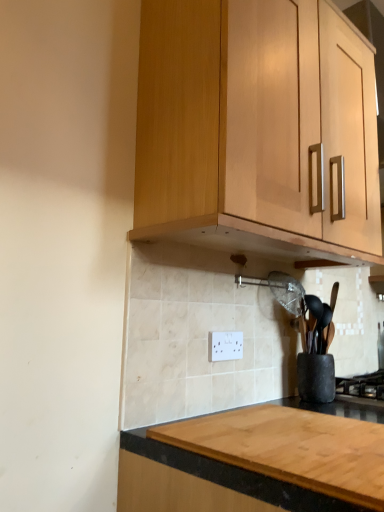
Measure the distance between point [241,335] and camera.

The depth of point [241,335] is 4.32 feet.

Describe the element at coordinates (251, 127) in the screenshot. I see `light wood cabinet at upper center` at that location.

Describe the element at coordinates (362, 386) in the screenshot. I see `black matte gas stove at lower right` at that location.

Locate an element on the screen. This screenshot has height=512, width=384. white plastic electric outlet at center is located at coordinates (225, 346).

From the image's perspective, which one is positioned higher, light wood cabinet at upper center or white plastic electric outlet at center?

light wood cabinet at upper center.

Does light wood cabinet at upper center appear on the left side of white plastic electric outlet at center?

No, light wood cabinet at upper center is not to the left of white plastic electric outlet at center.

Is light wood cabinet at upper center smaller than white plastic electric outlet at center?

No, light wood cabinet at upper center is not smaller than white plastic electric outlet at center.

From a real-world perspective, is black granite countertop at lower center over black matte gas stove at lower right?

No, from a real-world perspective, black granite countertop at lower center is not above black matte gas stove at lower right.

Does point (308, 443) come in front of point (345, 396)?

Yes.

Is black granite countertop at lower center in contact with black matte gas stove at lower right?

There is a gap between black granite countertop at lower center and black matte gas stove at lower right.

From the image's perspective, which one is positioned higher, black granite countertop at lower center or light wood cabinet at upper center?

light wood cabinet at upper center appears higher in the image.

Considering the relative sizes of black granite countertop at lower center and light wood cabinet at upper center in the image provided, is black granite countertop at lower center smaller than light wood cabinet at upper center?

Correct, black granite countertop at lower center occupies less space than light wood cabinet at upper center.

The image size is (384, 512). I want to click on cabinetry on the left of black granite countertop at lower center, so click(x=251, y=127).

Considering the relative sizes of black granite countertop at lower center and light wood cabinet at upper center in the image provided, is black granite countertop at lower center wider than light wood cabinet at upper center?

Yes.

From the image's perspective, which one is positioned higher, white plastic electric outlet at center or black granite countertop at lower center?

white plastic electric outlet at center.

Is white plastic electric outlet at center placed right next to black granite countertop at lower center?

There is a gap between white plastic electric outlet at center and black granite countertop at lower center.

Where is `electric outlet that is above the black granite countertop at lower center (from the image's perspective)`? electric outlet that is above the black granite countertop at lower center (from the image's perspective) is located at coordinates (225, 346).

Considering the positions of objects white plastic electric outlet at center and black granite countertop at lower center in the image provided, who is more to the left, white plastic electric outlet at center or black granite countertop at lower center?

white plastic electric outlet at center is more to the left.

Are black granite countertop at lower center and white plastic electric outlet at center far apart?

black granite countertop at lower center is near white plastic electric outlet at center, not far away.

In the scene shown: Does black granite countertop at lower center lie behind white plastic electric outlet at center?

That is False.

Could white plastic electric outlet at center be considered to be inside black granite countertop at lower center?

No, white plastic electric outlet at center is not inside black granite countertop at lower center.

This screenshot has width=384, height=512. In the image, there is a black matte gas stove at lower right. Find the location of `cabinetry above it (from the image's perspective)`. cabinetry above it (from the image's perspective) is located at coordinates (251, 127).

Considering the relative positions of light wood cabinet at upper center and black matte gas stove at lower right in the image provided, is light wood cabinet at upper center to the right of black matte gas stove at lower right from the viewer's perspective?

In fact, light wood cabinet at upper center is to the left of black matte gas stove at lower right.

Which object is further away from the camera, light wood cabinet at upper center or black matte gas stove at lower right?

black matte gas stove at lower right is behind.

From the image's perspective, is light wood cabinet at upper center above or below black matte gas stove at lower right?

Based on their image positions, light wood cabinet at upper center is located above black matte gas stove at lower right.

Are black matte gas stove at lower right and light wood cabinet at upper center far apart?

Actually, black matte gas stove at lower right and light wood cabinet at upper center are a little close together.

Is black matte gas stove at lower right facing away from light wood cabinet at upper center?

No.

Does black matte gas stove at lower right have a smaller size compared to light wood cabinet at upper center?

Yes.

Based on the photo, which is more to the left, black matte gas stove at lower right or light wood cabinet at upper center?

light wood cabinet at upper center is more to the left.

Where is `electric outlet below the light wood cabinet at upper center (from a real-world perspective)`? electric outlet below the light wood cabinet at upper center (from a real-world perspective) is located at coordinates (225, 346).

You are a GUI agent. You are given a task and a screenshot of the screen. Output one action in this format:
    pyautogui.click(x=<x>, y=<y>)
    Task: Click on the countertop lying on the left of black matte gas stove at lower right
    
    Given the screenshot: What is the action you would take?
    pos(254,463)

From the image, which object appears to be nearer to light wood cabinet at upper center, white plastic electric outlet at center or black matte gas stove at lower right?

white plastic electric outlet at center lies closer to light wood cabinet at upper center than the other object.

Estimate the real-world distances between objects in this image. Which object is further from light wood cabinet at upper center, black matte gas stove at lower right or black granite countertop at lower center?

black matte gas stove at lower right is further to light wood cabinet at upper center.

Based on the photo, when comparing their distances from white plastic electric outlet at center, does light wood cabinet at upper center or black matte gas stove at lower right seem closer?

The object closer to white plastic electric outlet at center is black matte gas stove at lower right.

Which object lies nearer to the anchor point black granite countertop at lower center, white plastic electric outlet at center or light wood cabinet at upper center?

white plastic electric outlet at center is positioned closer to the anchor black granite countertop at lower center.

From the picture: Looking at the image, which one is located closer to light wood cabinet at upper center, white plastic electric outlet at center or black granite countertop at lower center?

Among the two, white plastic electric outlet at center is located nearer to light wood cabinet at upper center.

Based on their spatial positions, is white plastic electric outlet at center or light wood cabinet at upper center further from black matte gas stove at lower right?

Based on the image, light wood cabinet at upper center appears to be further to black matte gas stove at lower right.

Which object lies further to the anchor point light wood cabinet at upper center, black granite countertop at lower center or black matte gas stove at lower right?

Based on the image, black matte gas stove at lower right appears to be further to light wood cabinet at upper center.

When comparing their distances from black granite countertop at lower center, does white plastic electric outlet at center or black matte gas stove at lower right seem further?

Among the two, black matte gas stove at lower right is located further to black granite countertop at lower center.

Where is `electric outlet between light wood cabinet at upper center and black granite countertop at lower center vertically`? The height and width of the screenshot is (512, 384). electric outlet between light wood cabinet at upper center and black granite countertop at lower center vertically is located at coordinates (225, 346).

The image size is (384, 512). Find the location of `electric outlet positioned between black granite countertop at lower center and black matte gas stove at lower right from near to far`. electric outlet positioned between black granite countertop at lower center and black matte gas stove at lower right from near to far is located at coordinates (225, 346).

Find the location of `electric outlet between light wood cabinet at upper center and black matte gas stove at lower right vertically`. electric outlet between light wood cabinet at upper center and black matte gas stove at lower right vertically is located at coordinates (225, 346).

At what (x,y) coordinates should I click in order to perform the action: click on gas stove that lies between light wood cabinet at upper center and black granite countertop at lower center from top to bottom. Please return your answer as a coordinate pair (x, y). Looking at the image, I should click on (362, 386).